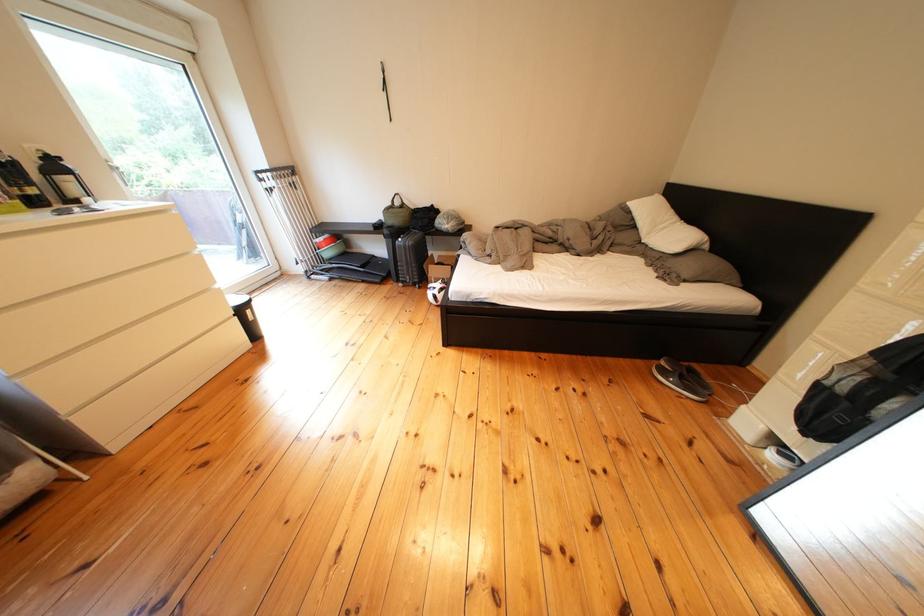
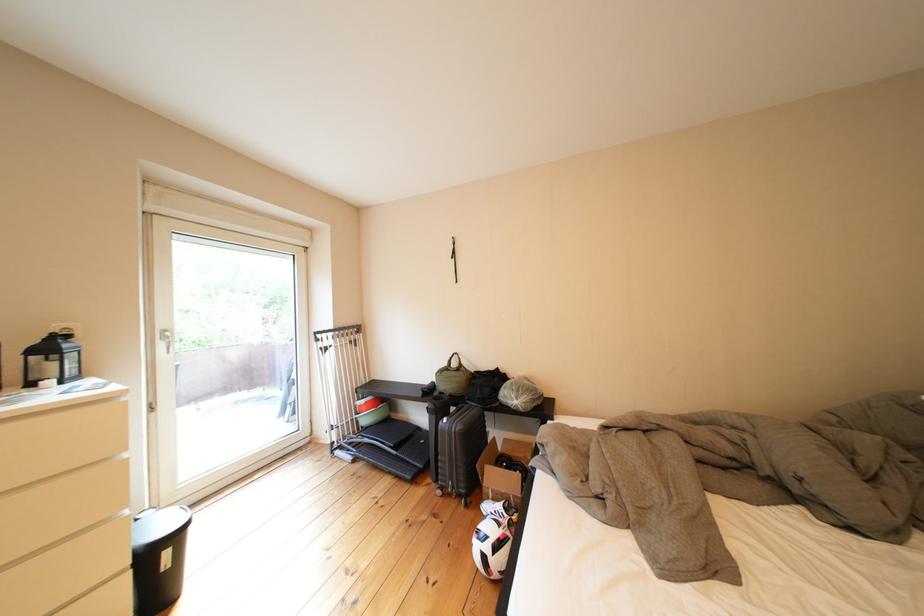
Find the pixel in the second image that matches (x=262, y=315) in the first image.

(179, 557)